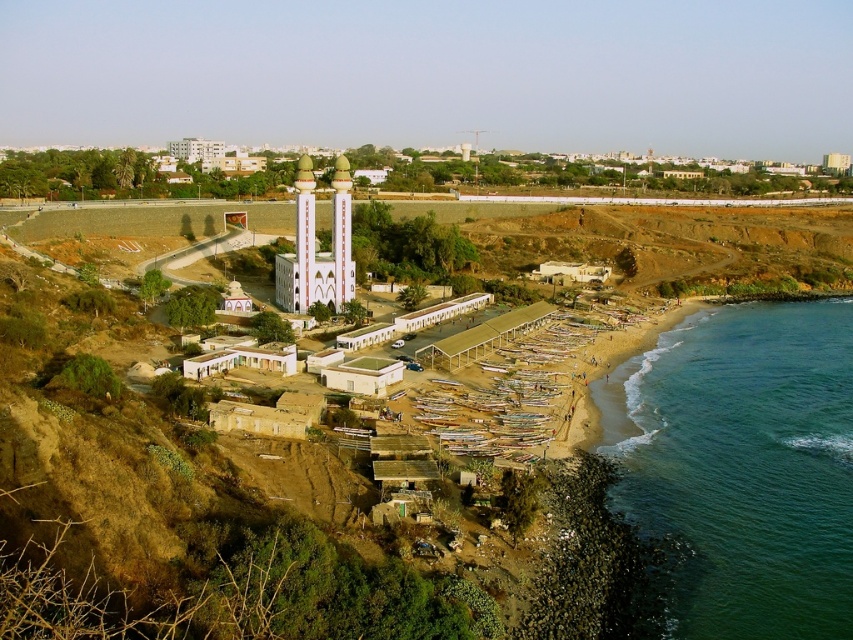
Measure the distance between white smooth mosque at center and white glossy tower at center.

3.52 meters

Can you confirm if white smooth mosque at center is thinner than white glossy tower at center?

No.

Identify the location of white smooth mosque at center. The width and height of the screenshot is (853, 640). (315, 246).

Is point (848, 604) farther from camera compared to point (302, 168)?

No.

The width and height of the screenshot is (853, 640). What do you see at coordinates (741, 467) in the screenshot?
I see `green smooth water at beach right` at bounding box center [741, 467].

Describe the element at coordinates (741, 467) in the screenshot. I see `green smooth water at beach right` at that location.

Identify the location of green smooth water at beach right. The image size is (853, 640). (741, 467).

Can you confirm if green smooth water at beach right is thinner than white glossy tower at center?

Incorrect, green smooth water at beach right's width is not less than white glossy tower at center's.

Between green smooth water at beach right and white glossy tower at center, which one has less height?

Standing shorter between the two is white glossy tower at center.

At what (x,y) coordinates should I click in order to perform the action: click on green smooth water at beach right. Please return your answer as a coordinate pair (x, y). The width and height of the screenshot is (853, 640). Looking at the image, I should click on (741, 467).